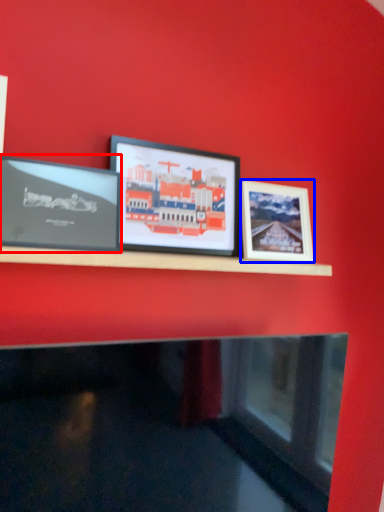
Question: Which object is further to the camera taking this photo, picture frame (highlighted by a red box) or picture frame (highlighted by a blue box)?

Choices:
 (A) picture frame
 (B) picture frame

Answer: (B)